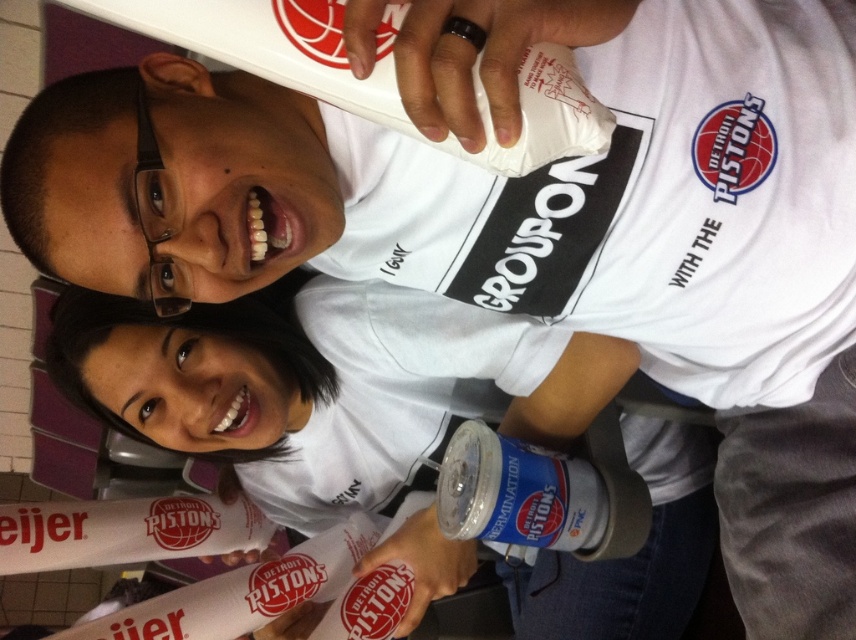
Looking at this image, you are standing in front of the image and want to determine which of the two points, point (x=426, y=444) or point (x=489, y=499), is closer to you. Based on the scene described, which point is nearer?

Point (x=426, y=444) is closer to you because it is further to the viewer than point (x=489, y=499) according to the description.